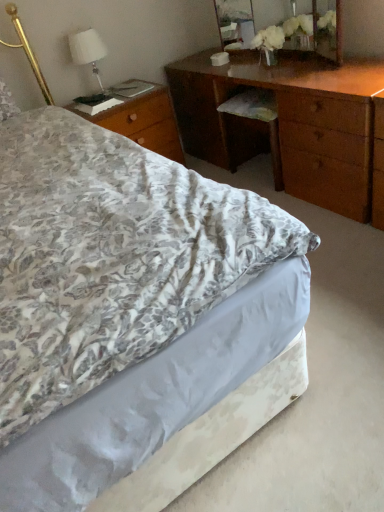
Question: Does wooden nightstand at left have a smaller size compared to floral fabric bed at center?

Choices:
 (A) yes
 (B) no

Answer: (A)

Question: Is the position of wooden nightstand at left less distant than that of floral fabric bed at center?

Choices:
 (A) yes
 (B) no

Answer: (B)

Question: Is wooden nightstand at left not near floral fabric bed at center?

Choices:
 (A) yes
 (B) no

Answer: (A)

Question: Is wooden nightstand at left placed right next to floral fabric bed at center?

Choices:
 (A) no
 (B) yes

Answer: (A)

Question: Is wooden nightstand at left facing away from floral fabric bed at center?

Choices:
 (A) no
 (B) yes

Answer: (A)

Question: Looking at the image, does wooden desk at center seem bigger or smaller compared to wooden mirror at upper center?

Choices:
 (A) big
 (B) small

Answer: (A)

Question: Considering the positions of wooden desk at center and wooden mirror at upper center in the image, is wooden desk at center taller or shorter than wooden mirror at upper center?

Choices:
 (A) short
 (B) tall

Answer: (B)

Question: From a real-world perspective, is wooden desk at center positioned above or below wooden mirror at upper center?

Choices:
 (A) above
 (B) below

Answer: (B)

Question: Does point (375, 91) appear closer or farther from the camera than point (322, 5)?

Choices:
 (A) farther
 (B) closer

Answer: (B)

Question: Does point [x=79, y=35] appear closer or farther from the camera than point [x=322, y=1]?

Choices:
 (A) farther
 (B) closer

Answer: (A)

Question: From a real-world perspective, is white fabric lampshade at upper left physically located above or below wooden mirror at upper center?

Choices:
 (A) below
 (B) above

Answer: (B)

Question: Looking at their shapes, would you say white fabric lampshade at upper left is wider or thinner than wooden mirror at upper center?

Choices:
 (A) wide
 (B) thin

Answer: (A)

Question: Would you say white fabric lampshade at upper left is inside or outside wooden mirror at upper center?

Choices:
 (A) outside
 (B) inside

Answer: (A)

Question: Is wooden mirror at upper center inside or outside of wooden nightstand at left?

Choices:
 (A) inside
 (B) outside

Answer: (B)

Question: Is wooden mirror at upper center in front of or behind wooden nightstand at left in the image?

Choices:
 (A) behind
 (B) front

Answer: (B)